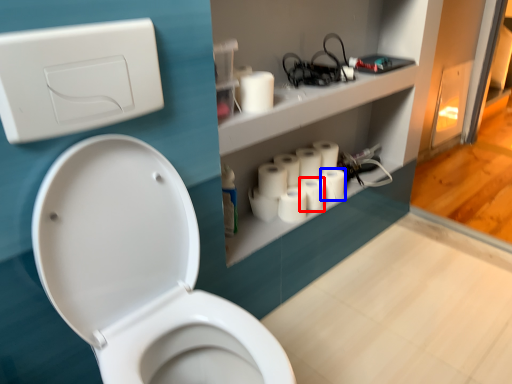
Question: Among these objects, which one is farthest to the camera, toilet paper (highlighted by a red box) or toilet paper (highlighted by a blue box)?

Choices:
 (A) toilet paper
 (B) toilet paper

Answer: (B)